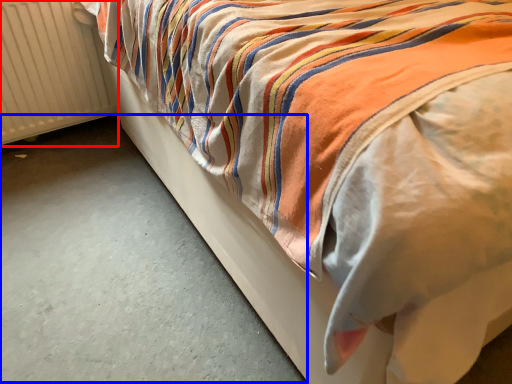
Question: Which of the following is the closest to the observer, radiator (highlighted by a red box) or concrete (highlighted by a blue box)?

Choices:
 (A) radiator
 (B) concrete

Answer: (B)